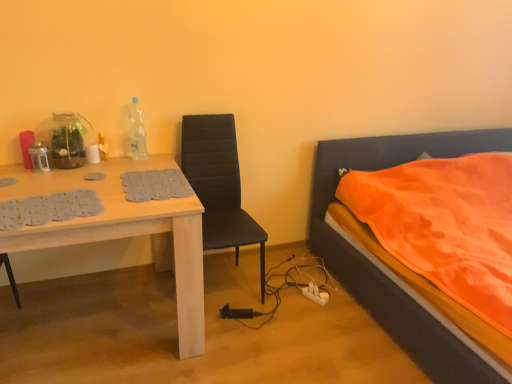
Find the location of a particular element. free point to the right of black leather chair at center is located at coordinates (297, 296).